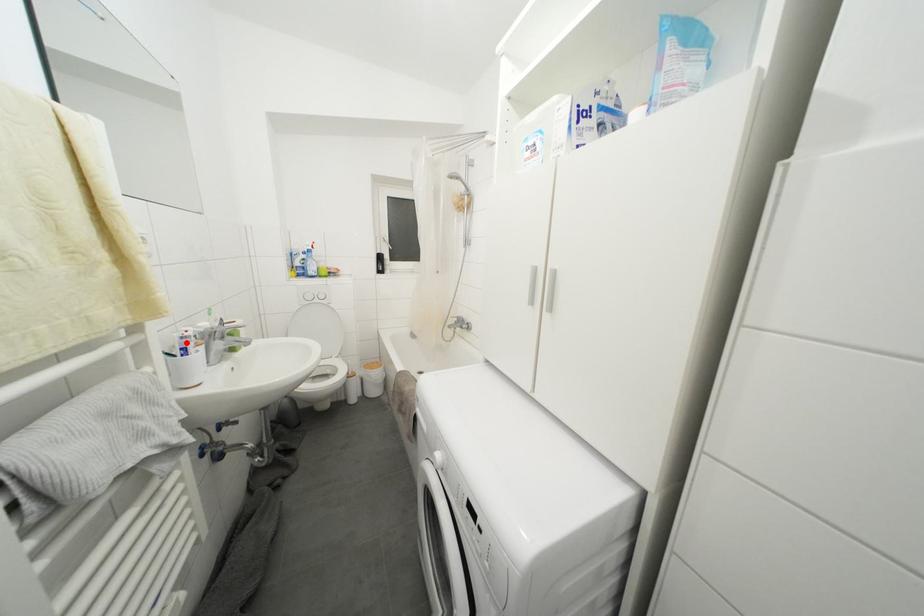
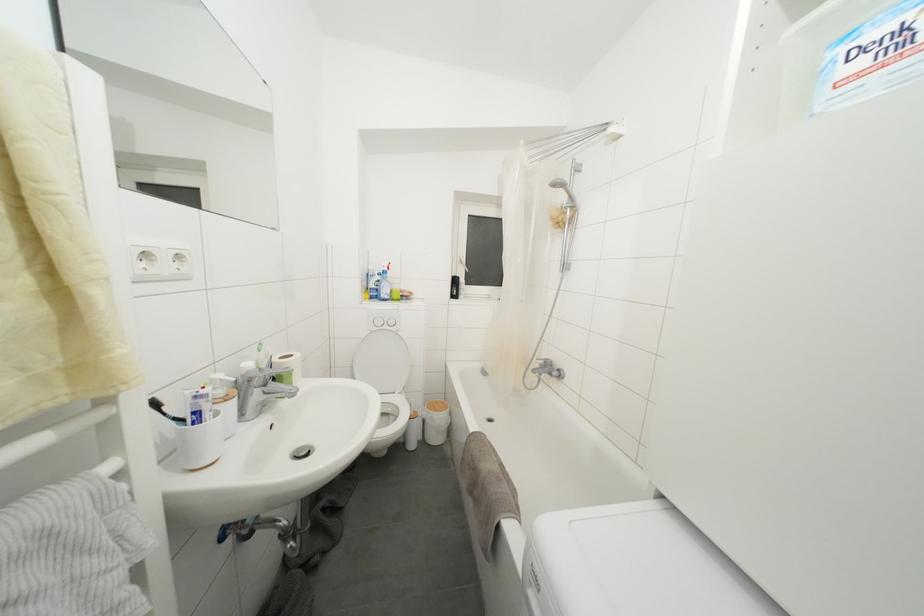
The point at the highlighted location is marked in the first image. Where is the corresponding point in the second image?

(200, 402)